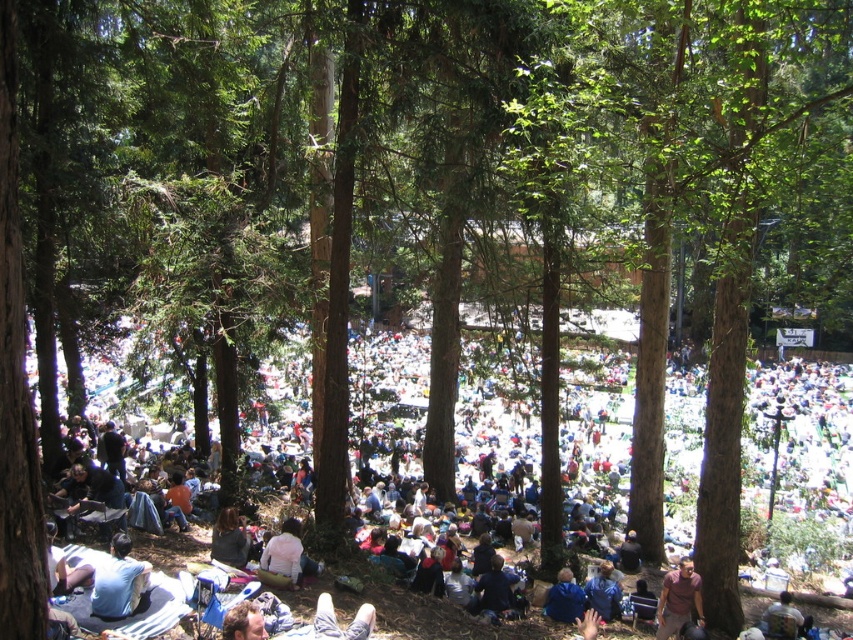
You are organizing a picnic in this forest scene and have two items to place on the ground. You have a light blue fabric at lower left and a dark gray sweater at lower center. Which item has a larger width and can be used as a better picnic blanket?

The light blue fabric at lower left has a larger width than the dark gray sweater at lower center, making it a better choice for a picnic blanket.

You are a photographer positioned at the edge of the forest scene. You notice the light blue fabric at lower left and the blue denim jeans at lower center in your viewfinder. Which object is closer to you?

The light blue fabric at lower left is closer to you because it is further to the viewer than the blue denim jeans at lower center.

You are standing at the center of the forest scene and want to locate the light blue fabric at lower left. According to the coordinates provided, where should you look relative to your current position?

The light blue fabric at lower left is located at coordinates point (801, 467), which means it is positioned to the lower left from your current position at the center of the forest scene.